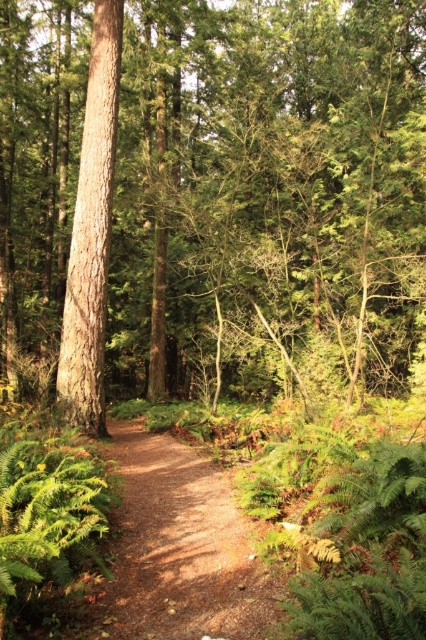
You are standing at the point closer to the camera along the dirt path in the forest. There are two points marked on the path, one at coordinates point (x=85, y=104) and another at point (x=71, y=323). Which point is farther away from you?

Point (x=85, y=104) is behind point (x=71, y=323), so the point farther away from you is point (x=85, y=104).

You are navigating a forest path and notice the brown rough tree at center. Based on its position, can you determine if it is closer to the left or right side of the path?

The brown rough tree at center is located at point coordinates that place it closer to the left side of the path.

You are a hiker who wants to take a photo of both the brown rough tree at center and the smooth brown tree trunk at center. Since you have a wide angle lens, can you capture both trees in the same frame without moving your camera position?

The brown rough tree at center is in front of the smooth brown tree trunk at center, so they are aligned along the same line of sight. With a wide angle lens, you can capture both trees in the same frame without moving the camera position.